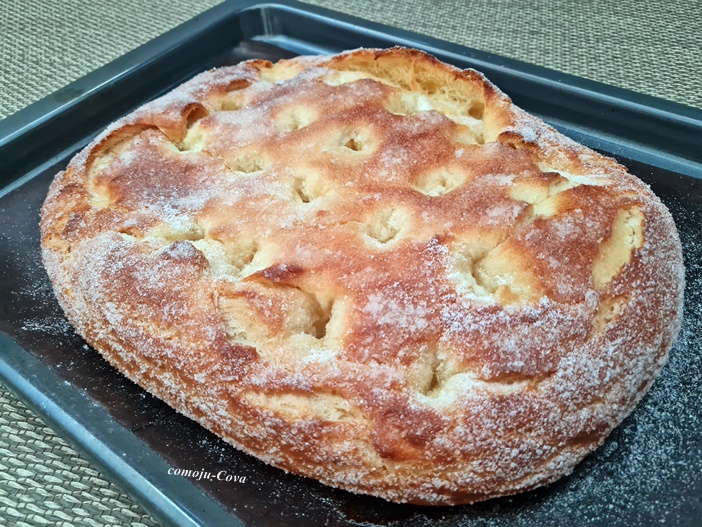
Find the location of a particular element. gray metal baking pan is located at coordinates (597, 106).